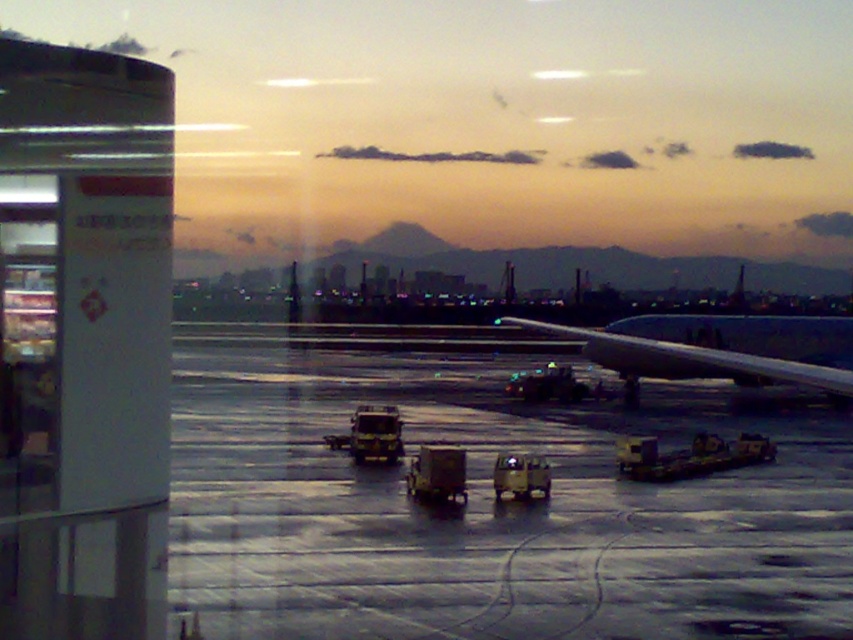
The image size is (853, 640). Find the location of `shiny gray tarmac at center`. shiny gray tarmac at center is located at coordinates (486, 509).

Between point (810, 492) and point (813, 372), which one is positioned in front?

Point (813, 372)

The height and width of the screenshot is (640, 853). I want to click on shiny gray tarmac at center, so click(x=486, y=509).